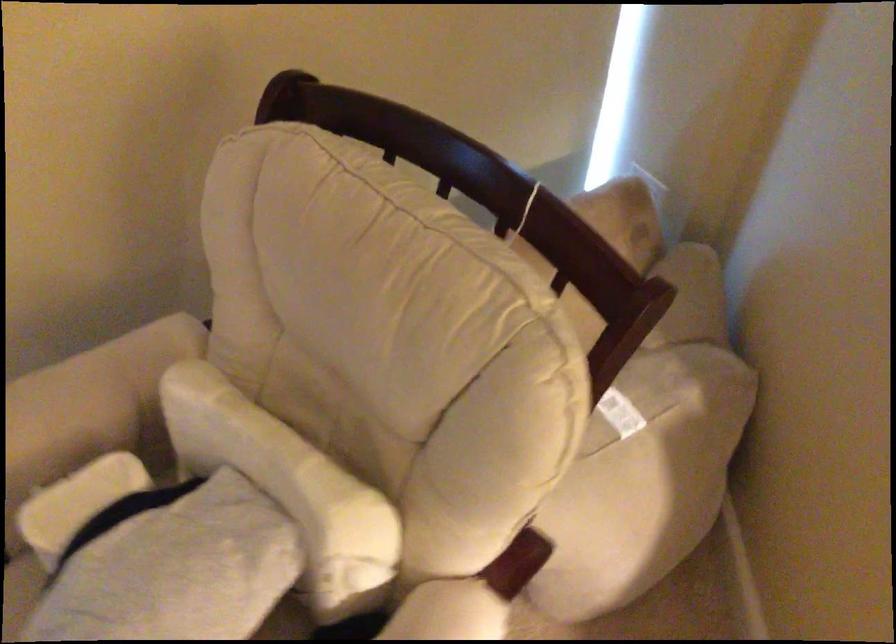
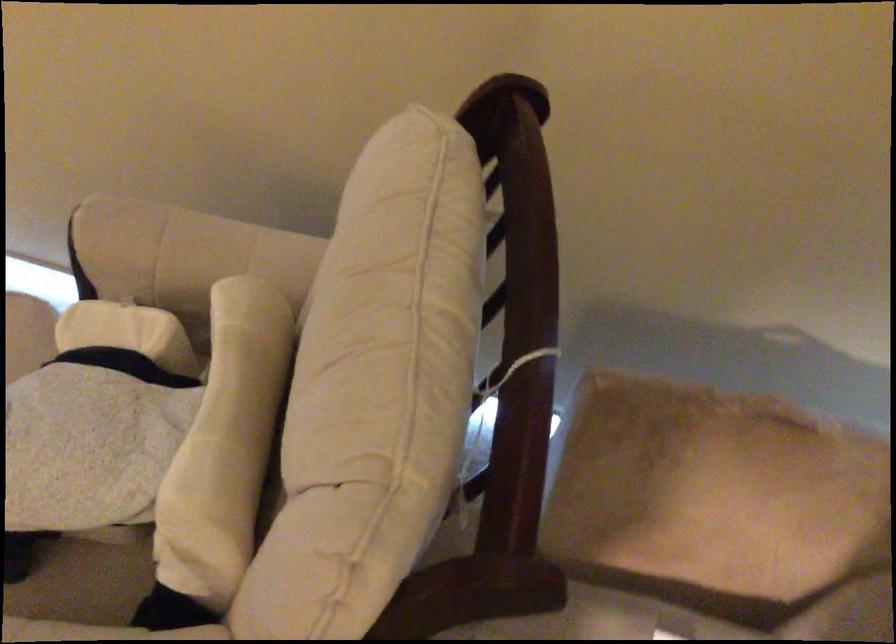
In the second image, find the point that corresponds to (326,458) in the first image.

(225, 444)